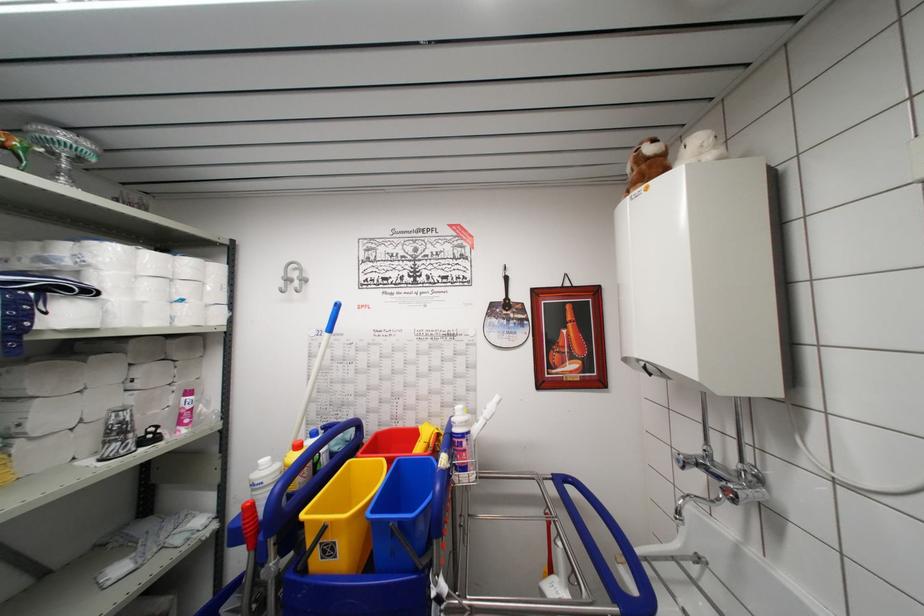
Describe the element at coordinates (293, 272) in the screenshot. I see `a grey wall hook` at that location.